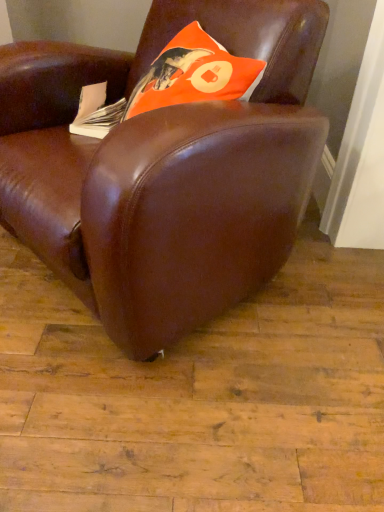
Question: From a real-world perspective, is white paper at left on top of brown leather chair at center?

Choices:
 (A) no
 (B) yes

Answer: (B)

Question: Is white paper at left outside brown leather chair at center?

Choices:
 (A) no
 (B) yes

Answer: (A)

Question: Does white paper at left have a lesser width compared to brown leather chair at center?

Choices:
 (A) yes
 (B) no

Answer: (A)

Question: Considering the relative sizes of white paper at left and brown leather chair at center in the image provided, is white paper at left taller than brown leather chair at center?

Choices:
 (A) yes
 (B) no

Answer: (B)

Question: Would you say brown leather chair at center is part of white paper at left's contents?

Choices:
 (A) no
 (B) yes

Answer: (A)

Question: Is white paper at left facing towards brown leather chair at center?

Choices:
 (A) no
 (B) yes

Answer: (B)

Question: Is orange matte pillow at upper center next to brown leather chair at center and touching it?

Choices:
 (A) yes
 (B) no

Answer: (B)

Question: Is orange matte pillow at upper center positioned far away from brown leather chair at center?

Choices:
 (A) no
 (B) yes

Answer: (A)

Question: Is orange matte pillow at upper center shorter than brown leather chair at center?

Choices:
 (A) no
 (B) yes

Answer: (B)

Question: Is orange matte pillow at upper center wider than brown leather chair at center?

Choices:
 (A) no
 (B) yes

Answer: (A)

Question: Considering the relative positions of orange matte pillow at upper center and brown leather chair at center in the image provided, is orange matte pillow at upper center to the left of brown leather chair at center from the viewer's perspective?

Choices:
 (A) yes
 (B) no

Answer: (B)

Question: From the image's perspective, is orange matte pillow at upper center beneath brown leather chair at center?

Choices:
 (A) yes
 (B) no

Answer: (B)

Question: Does white paper at left contain orange matte pillow at upper center?

Choices:
 (A) no
 (B) yes

Answer: (A)